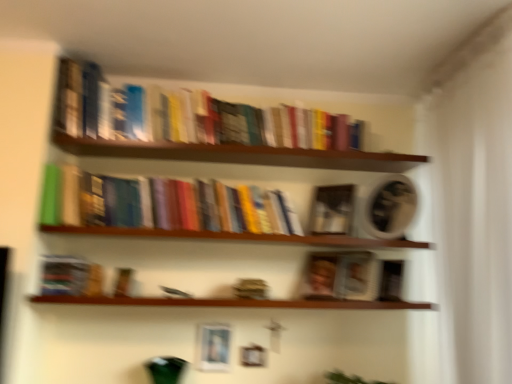
Question: Is point (134, 299) closer or farther from the camera than point (313, 238)?

Choices:
 (A) farther
 (B) closer

Answer: (B)

Question: Which is correct: wooden shelf at lower center, which is the 2th window sill in top-to-bottom order, is inside wooden shelf at center, which is counted as the first window sill, starting from the top, or outside of it?

Choices:
 (A) inside
 (B) outside

Answer: (B)

Question: Which of these objects is positioned closest to the matte brown book at center, marked as the first paperback book in a bottom-to-top arrangement?

Choices:
 (A) wooden shelf at center, acting as the second window sill starting from the bottom
 (B) matte black book at center, positioned as the second paperback book in right-to-left order
 (C) wooden books at upper center
 (D) hardcover books at center
 (E) wooden shelf at lower center, the first window sill in the bottom-to-top sequence

Answer: (B)

Question: Considering the real-world distances, which object is farthest from the hardcover books at center?

Choices:
 (A) wooden shelf at lower center, which is the 2th window sill in top-to-bottom order
 (B) matte brown book at center, acting as the 2th paperback book starting from the left
 (C) matte black book at center, positioned as the first paperback book in left-to-right order
 (D) matte silver picture frame at lower center
 (E) wooden books at upper center

Answer: (B)